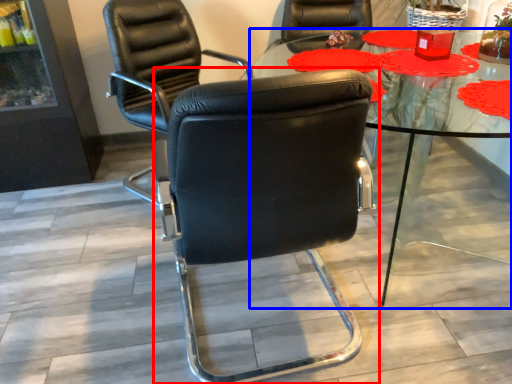
Question: Which point is closer to the camera, chair (highlighted by a red box) or table (highlighted by a blue box)?

Choices:
 (A) chair
 (B) table

Answer: (A)